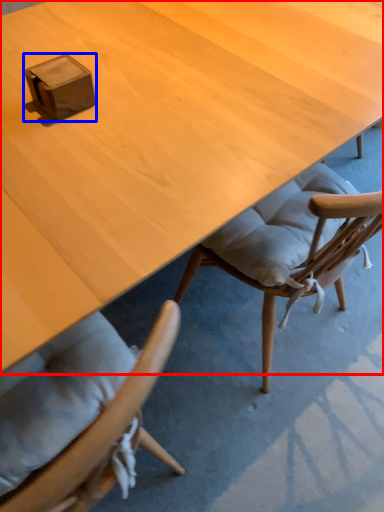
Question: Which object is further to the camera taking this photo, desk (highlighted by a red box) or box (highlighted by a blue box)?

Choices:
 (A) desk
 (B) box

Answer: (B)